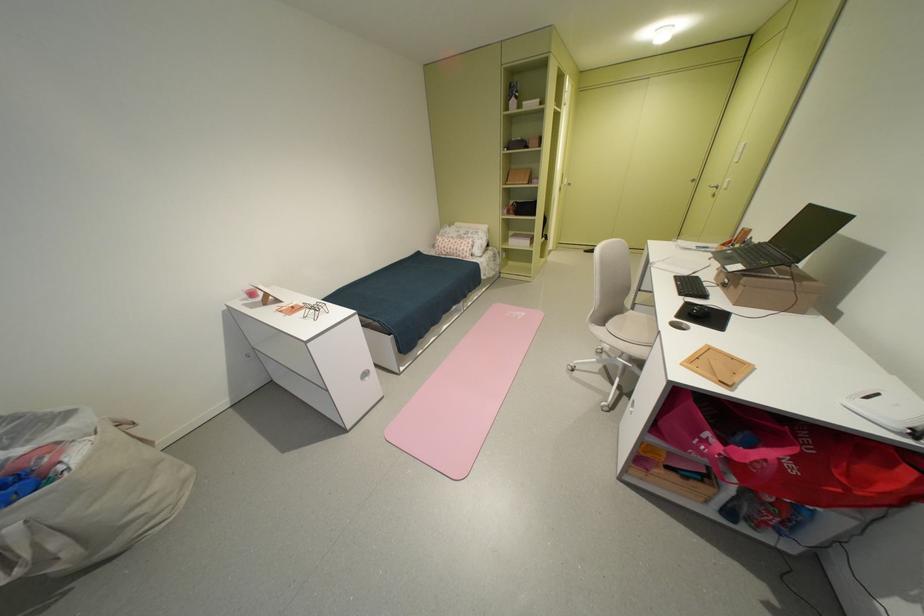
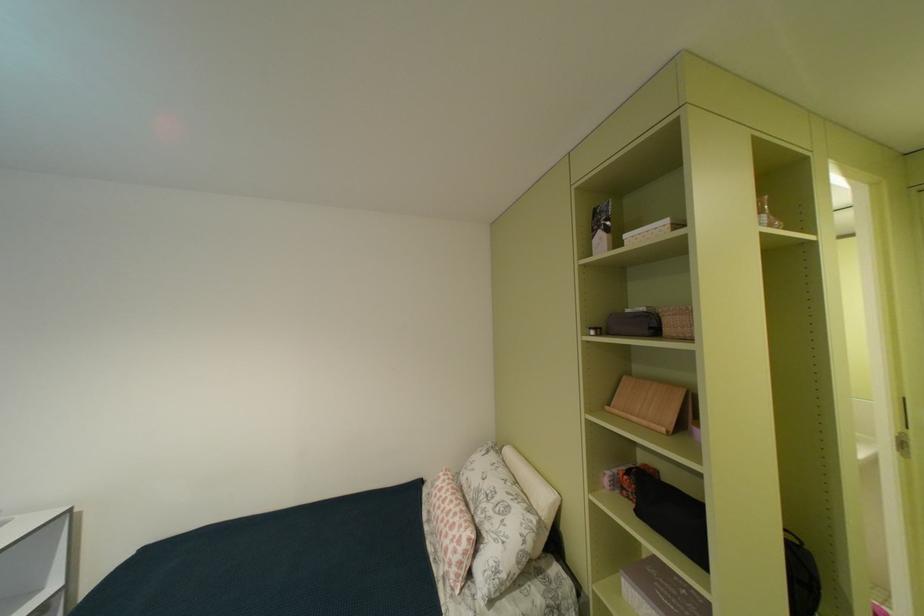
Locate, in the second image, the point that corresponds to (x=523, y=216) in the first image.

(641, 501)